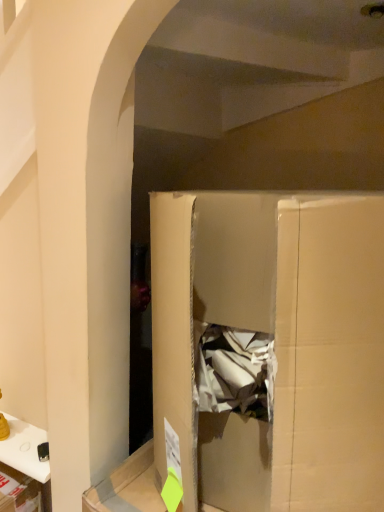
What do you see at coordinates (27, 454) in the screenshot? I see `white glossy phone at lower left` at bounding box center [27, 454].

Locate an element on the screen. The width and height of the screenshot is (384, 512). white glossy phone at lower left is located at coordinates (27, 454).

Identify the location of cardboard box at center. This screenshot has height=512, width=384. coord(275,344).

What do you see at coordinates (275, 344) in the screenshot?
I see `cardboard box at center` at bounding box center [275, 344].

What is the approximate height of cardboard box at center?

cardboard box at center is 30.85 inches tall.

Locate an element on the screen. The image size is (384, 512). white glossy phone at lower left is located at coordinates (27, 454).

Is cardboard box at center to the left or to the right of white glossy phone at lower left in the image?

cardboard box at center is to the right of white glossy phone at lower left.

Does cardboard box at center lie behind white glossy phone at lower left?

No, cardboard box at center is closer to the viewer.

Which is closer, (x=299, y=237) or (x=36, y=428)?

Point (x=299, y=237) is positioned closer to the camera compared to point (x=36, y=428).

From the image's perspective, is cardboard box at center above or below white glossy phone at lower left?

cardboard box at center is above white glossy phone at lower left.

From a real-world perspective, is cardboard box at center on top of white glossy phone at lower left?

Yes, from a real-world perspective, cardboard box at center is on top of white glossy phone at lower left.

In the scene shown: Can you confirm if cardboard box at center is wider than white glossy phone at lower left?

Indeed, cardboard box at center has a greater width compared to white glossy phone at lower left.

From their relative heights in the image, would you say cardboard box at center is taller or shorter than white glossy phone at lower left?

Clearly, cardboard box at center is taller compared to white glossy phone at lower left.

Based on their sizes in the image, would you say cardboard box at center is bigger or smaller than white glossy phone at lower left?

Clearly, cardboard box at center is larger in size than white glossy phone at lower left.

Based on the photo, can we say cardboard box at center lies outside white glossy phone at lower left?

cardboard box at center is positioned outside white glossy phone at lower left.

Does cardboard box at center touch white glossy phone at lower left?

There is a gap between cardboard box at center and white glossy phone at lower left.

Is cardboard box at center aimed at white glossy phone at lower left?

No, cardboard box at center is not aimed at white glossy phone at lower left.

Find the location of a particular element. The image size is (384, 512). furniture behind the cardboard box at center is located at coordinates (27, 454).

Considering the positions of objects white glossy phone at lower left and cardboard box at center in the image provided, who is more to the left, white glossy phone at lower left or cardboard box at center?

white glossy phone at lower left is more to the left.

Considering the relative positions of white glossy phone at lower left and cardboard box at center in the image provided, is white glossy phone at lower left behind cardboard box at center?

That is True.

Considering the points (12, 460) and (209, 274), which point is in front, point (12, 460) or point (209, 274)?

Point (209, 274)

From the image's perspective, would you say white glossy phone at lower left is positioned over cardboard box at center?

Incorrect, from the image's perspective, white glossy phone at lower left is lower than cardboard box at center.

From a real-world perspective, is white glossy phone at lower left below cardboard box at center?

Correct, in the physical world, white glossy phone at lower left is lower than cardboard box at center.

Considering the relative sizes of white glossy phone at lower left and cardboard box at center in the image provided, is white glossy phone at lower left thinner than cardboard box at center?

Correct, the width of white glossy phone at lower left is less than that of cardboard box at center.

Who is shorter, white glossy phone at lower left or cardboard box at center?

With less height is white glossy phone at lower left.

Which of these two, white glossy phone at lower left or cardboard box at center, is smaller?

white glossy phone at lower left.

Is white glossy phone at lower left completely or partially outside of cardboard box at center?

white glossy phone at lower left lies outside cardboard box at center's area.

Is white glossy phone at lower left positioned far away from cardboard box at center?

white glossy phone at lower left is actually quite close to cardboard box at center.

Is white glossy phone at lower left aimed at cardboard box at center?

No, white glossy phone at lower left does not turn towards cardboard box at center.

Based on the photo, what's the angular difference between white glossy phone at lower left and cardboard box at center's facing directions?

2.3 degrees separate the facing orientations of white glossy phone at lower left and cardboard box at center.

This screenshot has width=384, height=512. What are the coordinates of `cardboard box located on the right of white glossy phone at lower left` in the screenshot? It's located at (275, 344).

Where is `furniture below the cardboard box at center (from the image's perspective)`? The image size is (384, 512). furniture below the cardboard box at center (from the image's perspective) is located at coordinates (27, 454).

The image size is (384, 512). Find the location of `cardboard box on the right of white glossy phone at lower left`. cardboard box on the right of white glossy phone at lower left is located at coordinates (275, 344).